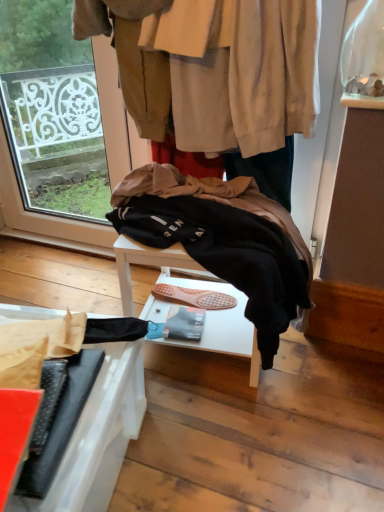
Question: In terms of width, does dark blue jeans at center look wider or thinner when compared to black matte umbrella at lower left?

Choices:
 (A) wide
 (B) thin

Answer: (B)

Question: From their relative heights in the image, would you say dark blue jeans at center is taller or shorter than black matte umbrella at lower left?

Choices:
 (A) short
 (B) tall

Answer: (A)

Question: Which object is positioned farthest from the dark blue jeans at center?

Choices:
 (A) black fleece jacket at center
 (B) black matte umbrella at lower left

Answer: (B)

Question: Which is farther from the black fleece jacket at center?

Choices:
 (A) dark blue jeans at center
 (B) black matte umbrella at lower left

Answer: (B)